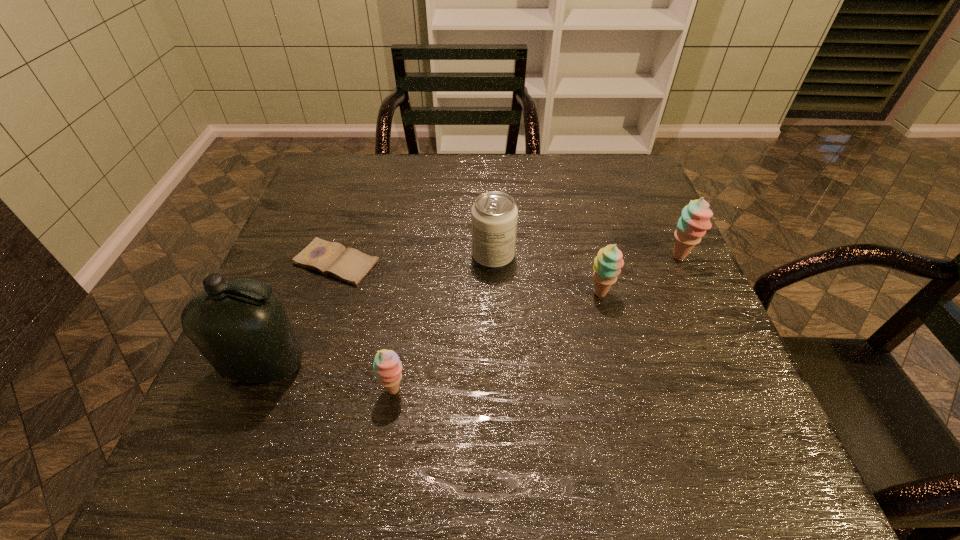
This screenshot has width=960, height=540. In order to click on sherbert that can be found as the closest to the fourth object from right to left in this screenshot , I will do `click(607, 266)`.

This screenshot has width=960, height=540. I want to click on vacant area that satisfies the following two spatial constraints: 1. on the back side of the soda can; 2. on the left side of the nearest sherbert, so click(x=415, y=256).

Identify the location of free point that satisfies the following two spatial constraints: 1. on the back side of the shortest object; 2. on the left side of the third object from right to left. (339, 256).